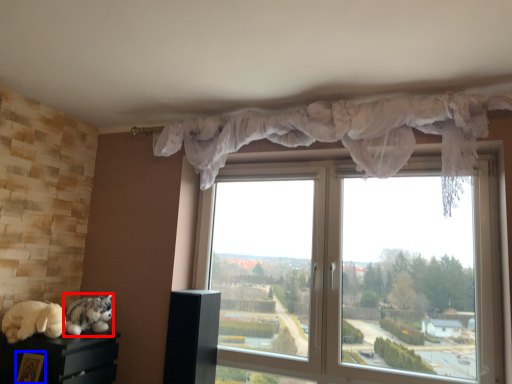
Question: Which object is closer to the camera taking this photo, cat (highlighted by a red box) or picture frame (highlighted by a blue box)?

Choices:
 (A) cat
 (B) picture frame

Answer: (B)